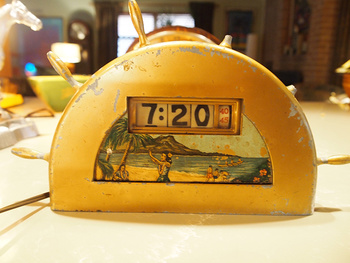
Locate an element on the screen. The image size is (350, 263). grandfather clock is located at coordinates (73, 26).